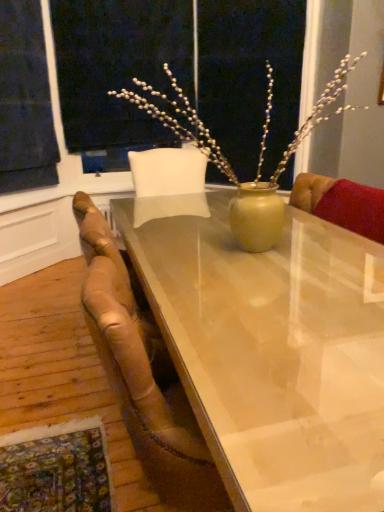
Question: Does dark blue fabric at upper left come in front of leather at left?

Choices:
 (A) no
 (B) yes

Answer: (A)

Question: Can you confirm if dark blue fabric at upper left is wider than leather at left?

Choices:
 (A) yes
 (B) no

Answer: (B)

Question: From a real-world perspective, is dark blue fabric at upper left below leather at left?

Choices:
 (A) yes
 (B) no

Answer: (B)

Question: Is dark blue fabric at upper left to the left of leather at left from the viewer's perspective?

Choices:
 (A) yes
 (B) no

Answer: (A)

Question: Is dark blue fabric at upper left smaller than leather at left?

Choices:
 (A) yes
 (B) no

Answer: (A)

Question: From a real-world perspective, relative to leather at left, is translucent glass table at center vertically above or below?

Choices:
 (A) below
 (B) above

Answer: (A)

Question: Is translucent glass table at center to the left or to the right of leather at left in the image?

Choices:
 (A) left
 (B) right

Answer: (B)

Question: From their relative heights in the image, would you say translucent glass table at center is taller or shorter than leather at left?

Choices:
 (A) tall
 (B) short

Answer: (B)

Question: Is translucent glass table at center bigger or smaller than leather at left?

Choices:
 (A) small
 (B) big

Answer: (B)

Question: Is dark blue fabric at upper left bigger or smaller than translucent glass table at center?

Choices:
 (A) small
 (B) big

Answer: (A)

Question: Would you say dark blue fabric at upper left is inside or outside translucent glass table at center?

Choices:
 (A) inside
 (B) outside

Answer: (B)

Question: From the image's perspective, is dark blue fabric at upper left above or below translucent glass table at center?

Choices:
 (A) below
 (B) above

Answer: (B)

Question: In the image, is dark blue fabric at upper left positioned in front of or behind translucent glass table at center?

Choices:
 (A) front
 (B) behind

Answer: (B)

Question: Considering the positions of leather at left and dark blue fabric at upper left in the image, is leather at left bigger or smaller than dark blue fabric at upper left?

Choices:
 (A) small
 (B) big

Answer: (B)

Question: From the image's perspective, relative to dark blue fabric at upper left, is leather at left above or below?

Choices:
 (A) above
 (B) below

Answer: (B)